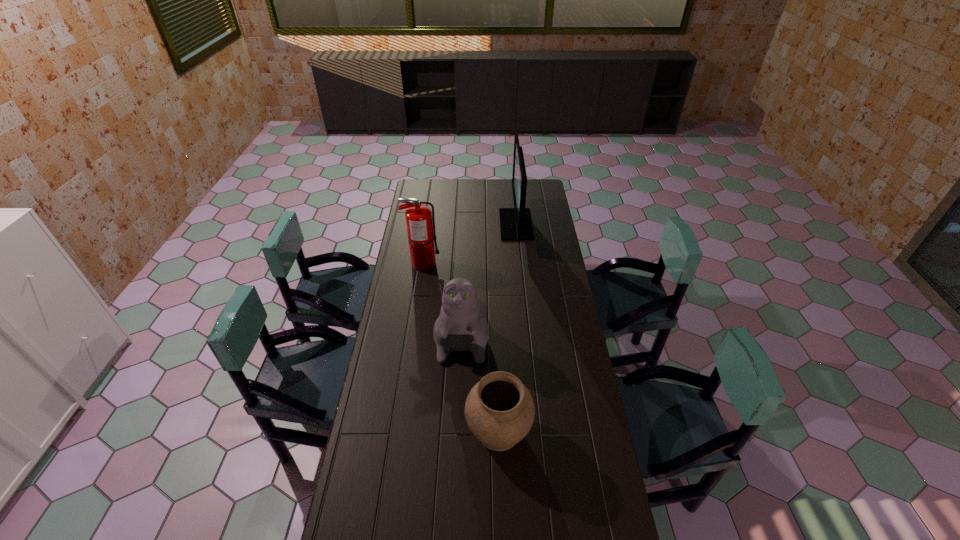
Locate an element on the screen. The image size is (960, 540). vacant space located at the nozzle of the fire extinguisher is located at coordinates (467, 264).

Find the location of a particular element. The width and height of the screenshot is (960, 540). vacant space located 0.060m on the face of the cat is located at coordinates (460, 378).

You are a GUI agent. You are given a task and a screenshot of the screen. Output one action in this format:
    pyautogui.click(x=<x>, y=<y>)
    Task: Click on the free space located on the back of the nearest object
    
    Given the screenshot: What is the action you would take?
    pyautogui.click(x=497, y=388)

At what (x,y) coordinates should I click in order to perform the action: click on object that is at the far edge. Please return your answer as a coordinate pair (x, y). The width and height of the screenshot is (960, 540). Looking at the image, I should click on (515, 223).

Where is `object that is at the left edge`? object that is at the left edge is located at coordinates (421, 232).

Locate an element on the screen. object located at the right edge is located at coordinates (515, 223).

Identify the location of object at the far right corner. This screenshot has width=960, height=540. (515, 223).

The image size is (960, 540). Find the location of `vacant point at the far edge`. vacant point at the far edge is located at coordinates (471, 195).

I want to click on free space at the left edge, so click(401, 388).

Where is `free location at the right edge of the desktop`? free location at the right edge of the desktop is located at coordinates (544, 211).